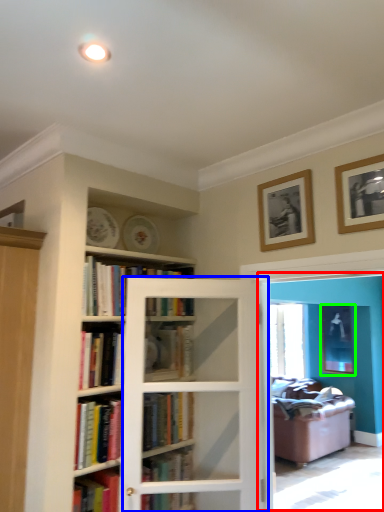
Question: Based on their relative distances, which object is nearer to screen door (highlighted by a red box)? Choose from screen door (highlighted by a blue box) and picture frame (highlighted by a green box).

Choices:
 (A) screen door
 (B) picture frame

Answer: (B)